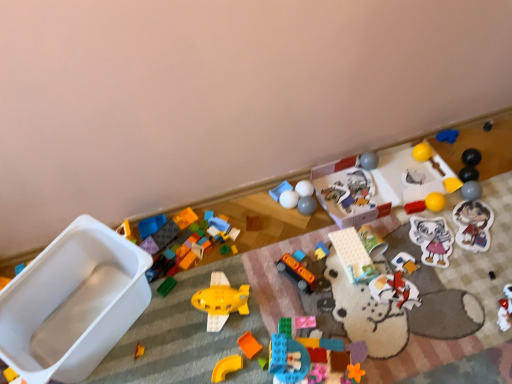
The height and width of the screenshot is (384, 512). What are the coordinates of `vacant space that is in between white plastic container at left, which is the 1th toy in left-to-right order, and orange matte block at center, which is the twentieth toy from right to left` in the screenshot? It's located at pos(176,348).